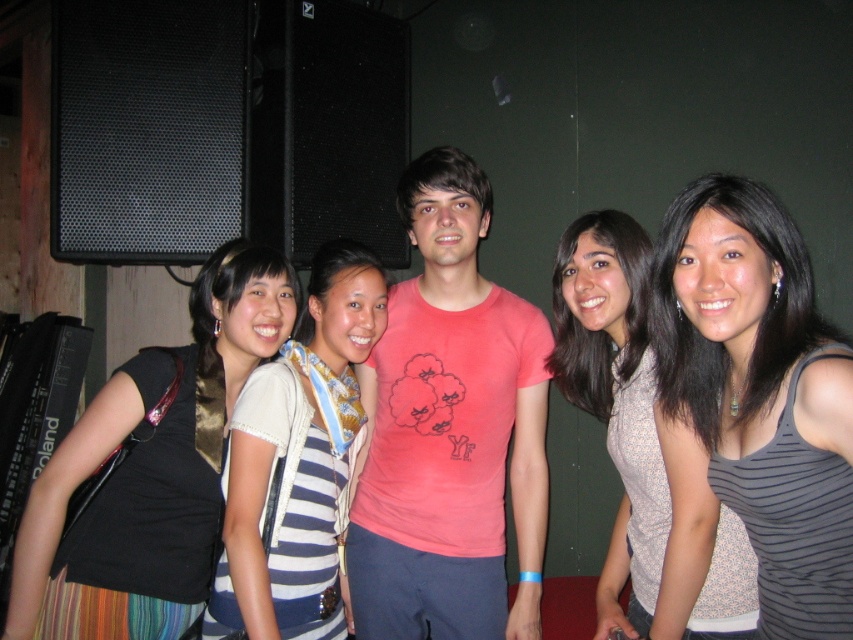
Does striped fabric dress at center have a greater height compared to patterned fabric top at center?

In fact, striped fabric dress at center may be shorter than patterned fabric top at center.

How far apart are striped fabric dress at center and patterned fabric top at center?

21.71 inches

At what (x,y) coordinates should I click in order to perform the action: click on striped fabric dress at center. Please return your answer as a coordinate pair (x, y). The image size is (853, 640). Looking at the image, I should click on point(299,460).

Who is more distant from viewer, (x=514, y=628) or (x=720, y=273)?

Point (x=514, y=628)

Does matte pink t-shirt at center come behind gray striped tank top at center?

Yes, matte pink t-shirt at center is further from the viewer.

Locate an element on the screen. matte pink t-shirt at center is located at coordinates (450, 429).

This screenshot has height=640, width=853. What do you see at coordinates (761, 394) in the screenshot?
I see `gray striped tank top at center` at bounding box center [761, 394].

Who is positioned more to the left, gray striped tank top at center or patterned fabric top at center?

Positioned to the left is patterned fabric top at center.

Between point (801, 483) and point (749, 596), which one is positioned behind?

The point (749, 596) is more distant.

Find the location of a particular element. gray striped tank top at center is located at coordinates (761, 394).